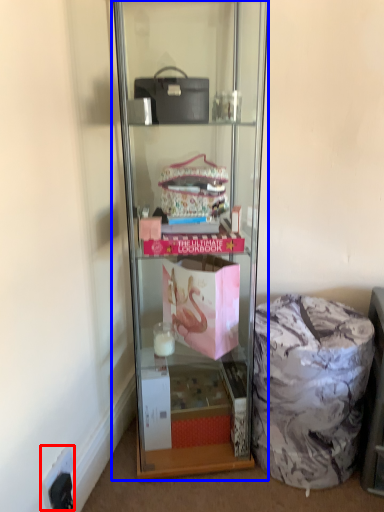
Question: Which of the following is the closest to the observer, electric outlet (highlighted by a red box) or shelf (highlighted by a blue box)?

Choices:
 (A) electric outlet
 (B) shelf

Answer: (B)